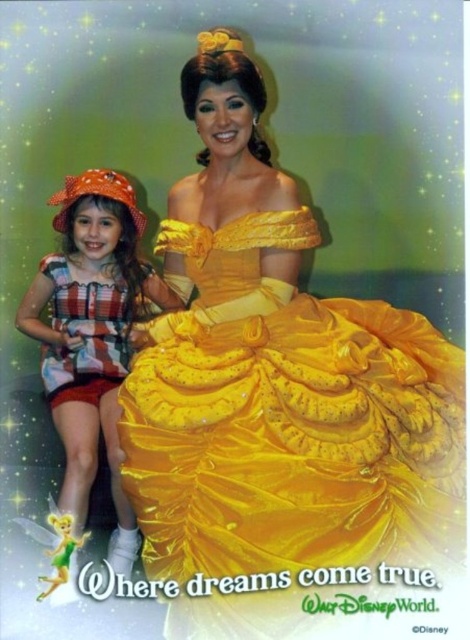
Question: Does shiny yellow dress at center appear under striped fabric dress at left?

Choices:
 (A) no
 (B) yes

Answer: (A)

Question: Which of the following is the farthest from the observer?

Choices:
 (A) (84, 340)
 (B) (139, 368)

Answer: (A)

Question: From the image, what is the correct spatial relationship of shiny yellow dress at center in relation to striped fabric dress at left?

Choices:
 (A) above
 (B) below

Answer: (A)

Question: Is shiny yellow dress at center below striped fabric dress at left?

Choices:
 (A) no
 (B) yes

Answer: (A)

Question: Among these points, which one is farthest from the camera?

Choices:
 (A) (102, 387)
 (B) (250, 300)

Answer: (A)

Question: Among these points, which one is farthest from the camera?

Choices:
 (A) (260, 161)
 (B) (83, 464)

Answer: (A)